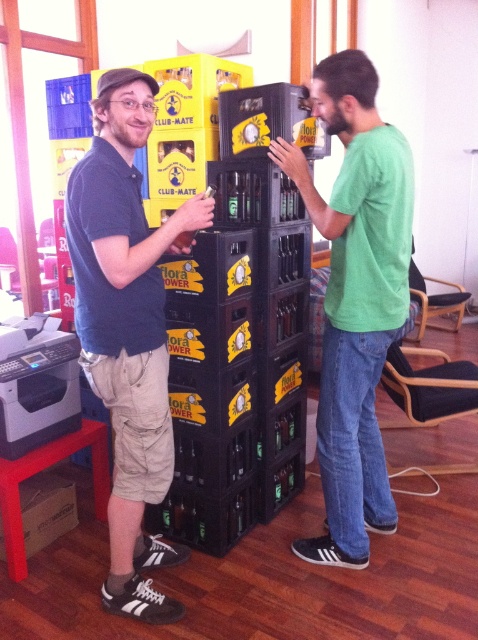
Is green matte shirt at center wider than red plastic stool at lower left?

Yes, green matte shirt at center is wider than red plastic stool at lower left.

Is point (356, 397) more distant than point (7, 531)?

No, it is not.

You are a GUI agent. You are given a task and a screenshot of the screen. Output one action in this format:
    pyautogui.click(x=<x>, y=<y>)
    Task: Click on the green matte shirt at center
    This screenshot has width=478, height=640.
    Given the screenshot: What is the action you would take?
    pyautogui.click(x=356, y=300)

Is matte black shirt at left below red plastic stool at lower left?

Actually, matte black shirt at left is above red plastic stool at lower left.

Looking at this image, is matte black shirt at left further to camera compared to red plastic stool at lower left?

No, it is not.

Find the location of `matte black shirt at left`. matte black shirt at left is located at coordinates (127, 330).

You are a GUI agent. You are given a task and a screenshot of the screen. Output one action in this format:
    pyautogui.click(x=<x>, y=<y>)
    Task: Click on the matte black shirt at left
    
    Given the screenshot: What is the action you would take?
    pyautogui.click(x=127, y=330)

Which is above, black matte printer at left or red plastic stool at lower left?

black matte printer at left is above.

Does black matte printer at left have a greater height compared to red plastic stool at lower left?

Correct, black matte printer at left is much taller as red plastic stool at lower left.

Does point (63, 397) lie behind point (104, 472)?

No.

Find the location of a particular element. This screenshot has width=478, height=640. black matte printer at left is located at coordinates (36, 385).